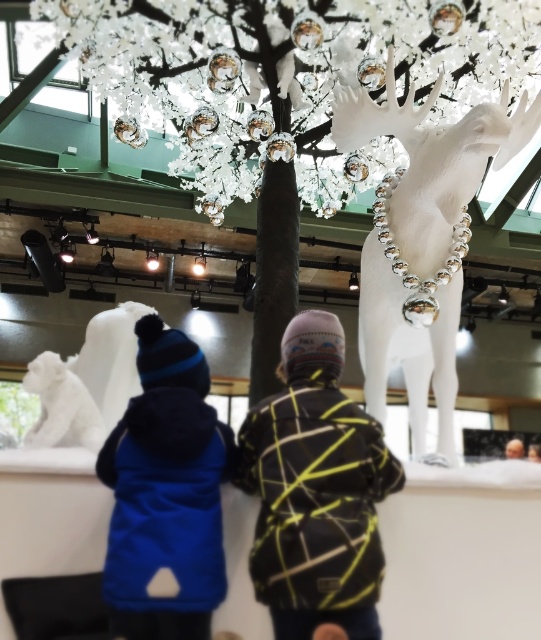
Is white matte sculpture at left to the left of white fur tiger at lower left from the viewer's perspective?

No, white matte sculpture at left is not to the left of white fur tiger at lower left.

Who is positioned more to the right, white matte sculpture at left or white fur tiger at lower left?

From the viewer's perspective, white matte sculpture at left appears more on the right side.

Where is `white matte sculpture at left`? white matte sculpture at left is located at coordinates point(87,381).

Where is `blue soft vest at center`? The image size is (541, 640). blue soft vest at center is located at coordinates (166, 493).

Is point (192, 545) more distant than point (91, 339)?

No.

Is point (149, 624) in front of point (47, 422)?

Yes, point (149, 624) is closer to viewer.

Find the location of a particular element. blue soft vest at center is located at coordinates (166, 493).

In the scene shown: Which of these two, white fur tiger at lower left or smooth brown hair at upper center, stands taller?

white fur tiger at lower left is taller.

Where is `white fur tiger at lower left`? white fur tiger at lower left is located at coordinates (62, 406).

Measure the distance between point (96,442) and camera.

Point (96,442) is 7.11 feet from camera.

Where is `white fur tiger at lower left`? Image resolution: width=541 pixels, height=640 pixels. white fur tiger at lower left is located at coordinates [62, 406].